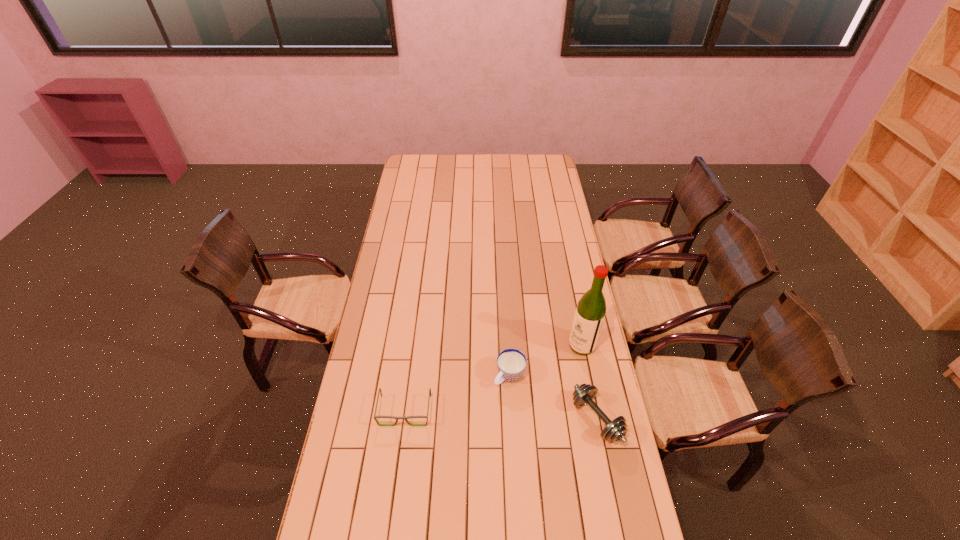
Where is `the leftmost object`? the leftmost object is located at coordinates click(x=393, y=417).

You are a GUI agent. You are given a task and a screenshot of the screen. Output one action in this format:
    pyautogui.click(x=<x>, y=<y>)
    Task: Click on the shortest object
    The height and width of the screenshot is (540, 960).
    Given the screenshot: What is the action you would take?
    pyautogui.click(x=393, y=417)

The height and width of the screenshot is (540, 960). I want to click on dumbbell, so click(x=584, y=394).

This screenshot has width=960, height=540. What are the coordinates of `the tallest object` in the screenshot? It's located at (590, 312).

Where is `the farthest object`? the farthest object is located at coordinates (590, 312).

The width and height of the screenshot is (960, 540). In order to click on the second farthest object in this screenshot , I will do `click(511, 363)`.

Where is `cup`? Image resolution: width=960 pixels, height=540 pixels. cup is located at coordinates (511, 363).

I want to click on vacant space located 0.140m on the lens of the spectacles, so click(397, 468).

Find the location of a particular element. The image size is (960, 540). free region located on the front of the dumbbell is located at coordinates (615, 512).

Locate an element on the screen. Image resolution: width=960 pixels, height=540 pixels. vacant region located on the label of the tallest object is located at coordinates (563, 361).